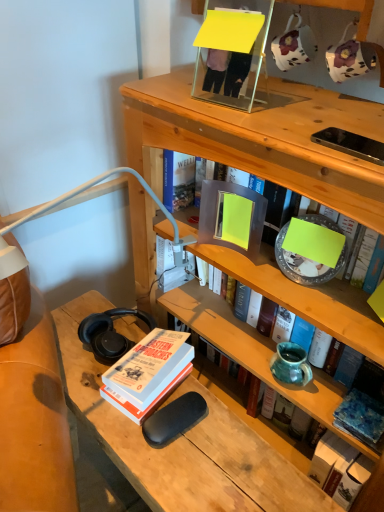
Question: From their relative heights in the image, would you say hardcover book at upper center, which is the third book in bottom-to-top order, is taller or shorter than blue textured fabric at lower right, marked as the 4th book in a top-to-bottom arrangement?

Choices:
 (A) short
 (B) tall

Answer: (B)

Question: Do you think hardcover book at upper center, which is the third book in bottom-to-top order, is within blue textured fabric at lower right, marked as the 4th book in a top-to-bottom arrangement, or outside of it?

Choices:
 (A) outside
 (B) inside

Answer: (A)

Question: Which object is positioned farthest from the hardcover book at upper center, which is counted as the 2th book, starting from the top?

Choices:
 (A) hardcover book at lower left, acting as the 2th book starting from the bottom
 (B) matte gray book at center, placed as the 4th book when sorted from bottom to top
 (C) blue textured fabric at lower right, placed as the first book when sorted from bottom to top
 (D) teal ceramic vase at middle right

Answer: (C)

Question: Which object is positioned closest to the teal ceramic vase at middle right?

Choices:
 (A) hardcover book at upper center, which is counted as the 2th book, starting from the top
 (B) matte gray book at center, arranged as the first book when viewed from the top
 (C) hardcover book at lower left, acting as the 2th book starting from the bottom
 (D) blue textured fabric at lower right, marked as the 4th book in a top-to-bottom arrangement

Answer: (D)